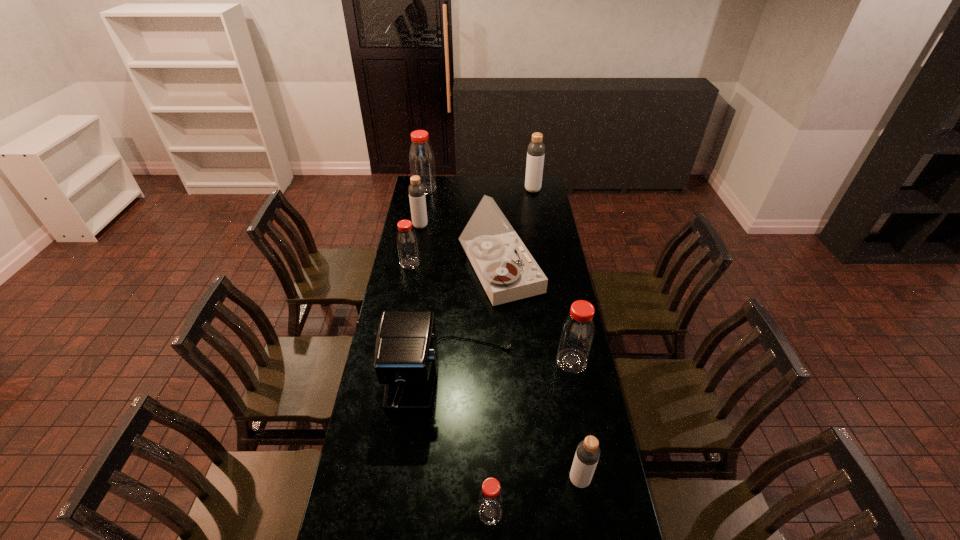
You are a GUI agent. You are given a task and a screenshot of the screen. Output one action in this format:
    pyautogui.click(x=<x>, y=<y>)
    Task: Click on the second nearest object
    Image resolution: width=960 pixels, height=540 pixels.
    Given the screenshot: What is the action you would take?
    pyautogui.click(x=587, y=454)

Identify the location of the nearest gray bottle. The height and width of the screenshot is (540, 960). (587, 454).

At what (x,y) coordinates should I click in order to perform the action: click on the nearest bottle. Please return your answer as a coordinate pair (x, y). The height and width of the screenshot is (540, 960). Looking at the image, I should click on [490, 498].

The width and height of the screenshot is (960, 540). I want to click on the nearest object, so pyautogui.click(x=490, y=498).

Where is `vacant space situated 0.130m on the right of the farthest red bottle`? Image resolution: width=960 pixels, height=540 pixels. vacant space situated 0.130m on the right of the farthest red bottle is located at coordinates (458, 189).

Locate an element on the screen. vacant space located on the front of the farthest gray bottle is located at coordinates (537, 211).

At what (x,y) coordinates should I click in order to perform the action: click on vacant space situated on the back of the white record player. Please return your answer as a coordinate pair (x, y). The image size is (960, 540). Looking at the image, I should click on (499, 240).

Locate an element on the screen. Image resolution: width=960 pixels, height=540 pixels. free space located 0.340m on the front of the second nearest gray bottle is located at coordinates (413, 272).

This screenshot has width=960, height=540. I want to click on free space located 0.060m on the back of the third nearest bottle, so click(x=567, y=337).

Where is `free spot located 0.280m on the front-facing side of the black coffee maker`? Image resolution: width=960 pixels, height=540 pixels. free spot located 0.280m on the front-facing side of the black coffee maker is located at coordinates (442, 516).